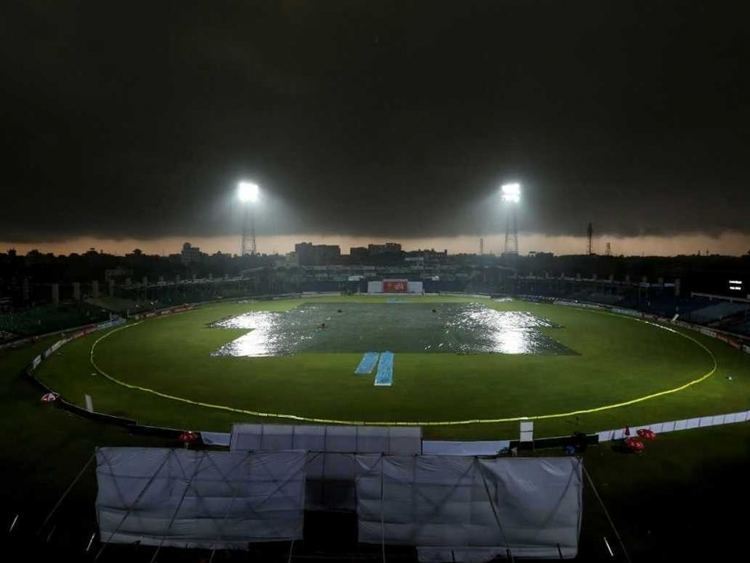
I want to click on rafters, so click(241, 501), click(334, 420), click(504, 504).